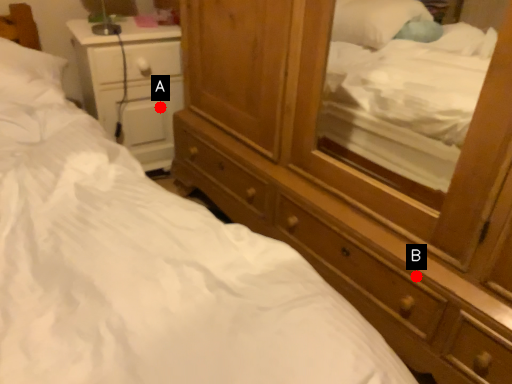
Question: Two points are circled on the image, labeled by A and B beside each circle. Among these points, which one is nearest to the camera?

Choices:
 (A) A is closer
 (B) B is closer

Answer: (B)